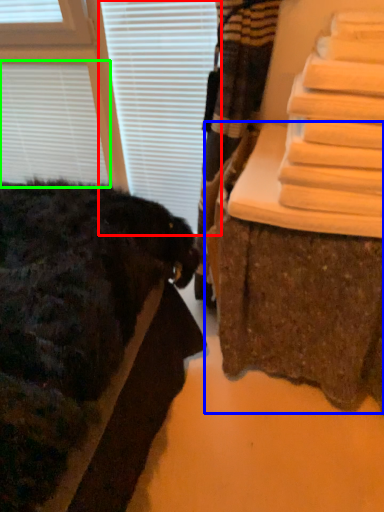
Question: Considering the real-world distances, which object is closest to blind (highlighted by a red box)? furniture (highlighted by a blue box) or blind (highlighted by a green box).

Choices:
 (A) furniture
 (B) blind

Answer: (B)